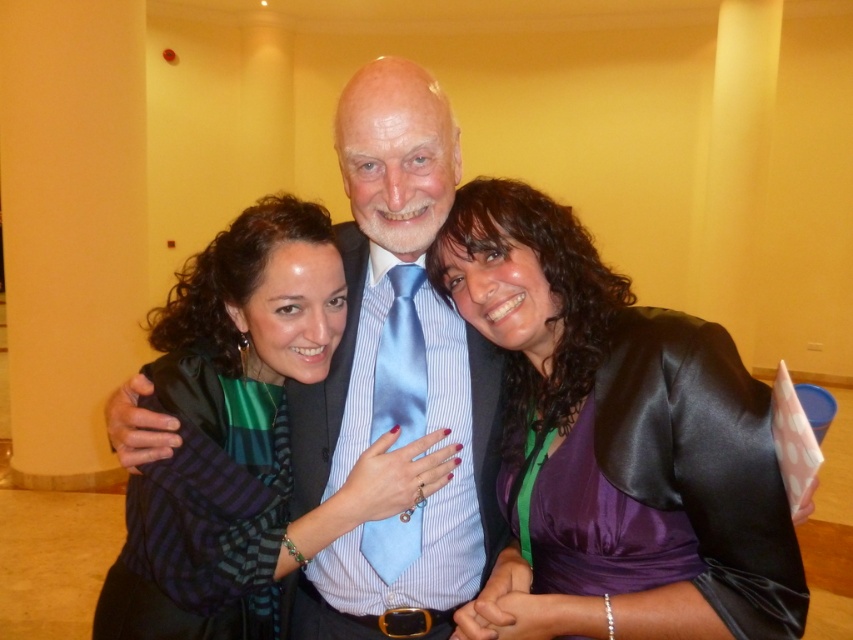
Is satin purple dress at center bigger than blue satin tie at center?

No, satin purple dress at center is not bigger than blue satin tie at center.

Based on the photo, between satin purple dress at center and blue satin tie at center, which one has more height?

Standing taller between the two is blue satin tie at center.

Locate an element on the screen. The image size is (853, 640). satin purple dress at center is located at coordinates (618, 436).